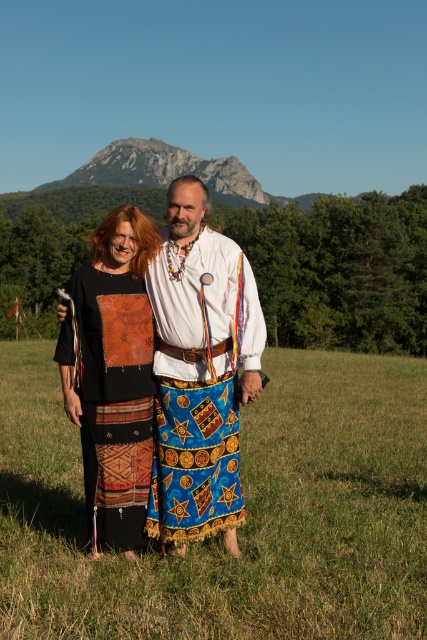
Which is in front, point (227, 317) or point (149, 330)?

Point (227, 317)

Is point (201, 278) closer to camera compared to point (134, 205)?

That is True.

I want to click on blue printed skirt at center, so click(x=199, y=387).

Is point (374, 492) farther from viewer compared to point (189, 275)?

Yes.

Does green grass at center have a greater height compared to blue printed skirt at center?

No.

Is point (38, 406) behind point (157, 502)?

Yes, point (38, 406) is farther from viewer.

Image resolution: width=427 pixels, height=640 pixels. What are the coordinates of `green grass at center` in the screenshot? It's located at coord(246,515).

Is point (98, 388) positioned behind point (116, 173)?

That is False.

Can you confirm if leather patchwork dress at center is positioned below rugged stone mountain at upper center?

Yes.

Between point (104, 310) and point (81, 164), which one is positioned in front?

Point (104, 310) is in front.

Where is `leather patchwork dress at center`? leather patchwork dress at center is located at coordinates (113, 374).